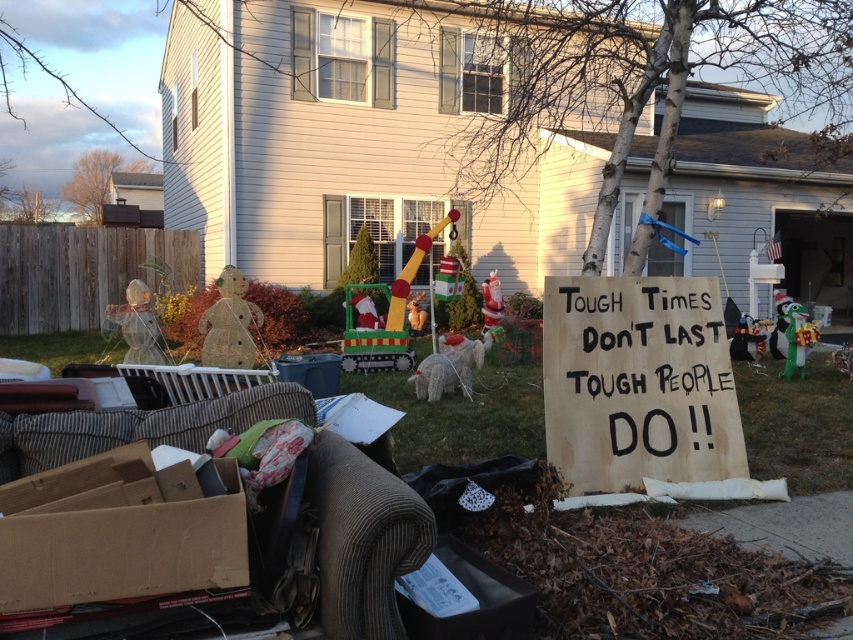
Looking at this image, you are a delivery person trying to place a new package in the backyard. The package is 1.2 meters tall. There is a brown cardboard sign at center and a brown cardboard box at lower left. Which object can the package be placed next to without exceeding its height?

The package can be placed next to the brown cardboard box at lower left since the brown cardboard sign at center is much taller than the brown cardboard box at lower left, making the box a safer option for height compatibility.

You are a delivery person trying to find the correct address. You see a brown cardboard sign at center and a brown cardboard box at lower left in the yard. Which object is higher up in the scene?

The brown cardboard sign at center is located above the brown cardboard box at lower left, so the brown cardboard sign at center is higher up in the scene.

You are standing in the backyard and want to place a small potted plant between the two points labeled point (631, 458) and point (129, 520). Which point should the plant be closer to if you want it to be nearer to the camera?

The plant should be placed closer to point (129, 520) because point (631, 458) is further away from the camera compared to point (129, 520).